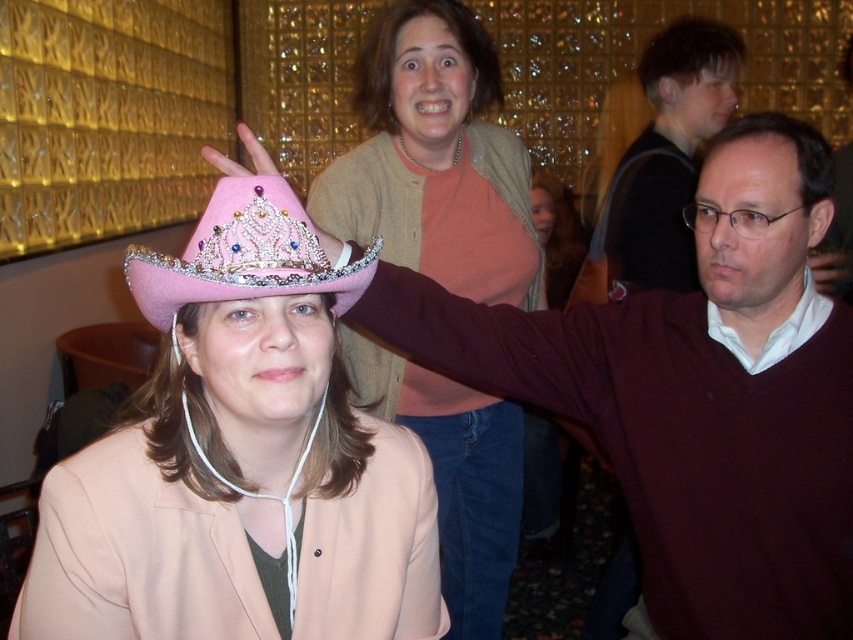
You are at the point marked by the coordinates point (241, 460). What object are you standing on?

You are standing on the pink felt hat at lower left represented by point (241, 460).

Based on the photo, you are standing in the room and want to determine which of the two points, point (x=152, y=428) or point (x=514, y=504), is nearer to you. Based on the scene description, which point is closer?

Point (x=152, y=428) is closer to the viewer than point (x=514, y=504).

You are planning to decorate a table for a party and have both the pink felt hat at lower left and the pink fabric tiara at upper center. Which of these two items is smaller in size?

The pink felt hat at lower left is smaller than the pink fabric tiara at upper center.